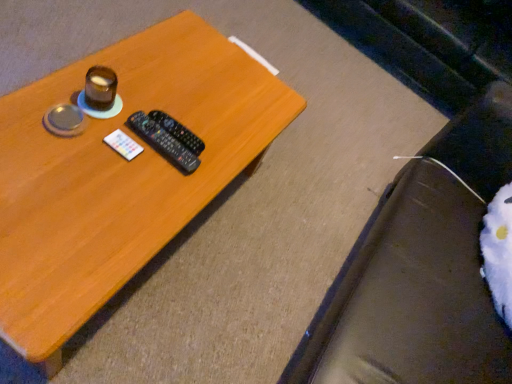
Locate an element on the screen. vacant space to the left of black plastic remote at center, placed as the second remote control when sorted from back to front is located at coordinates (115, 91).